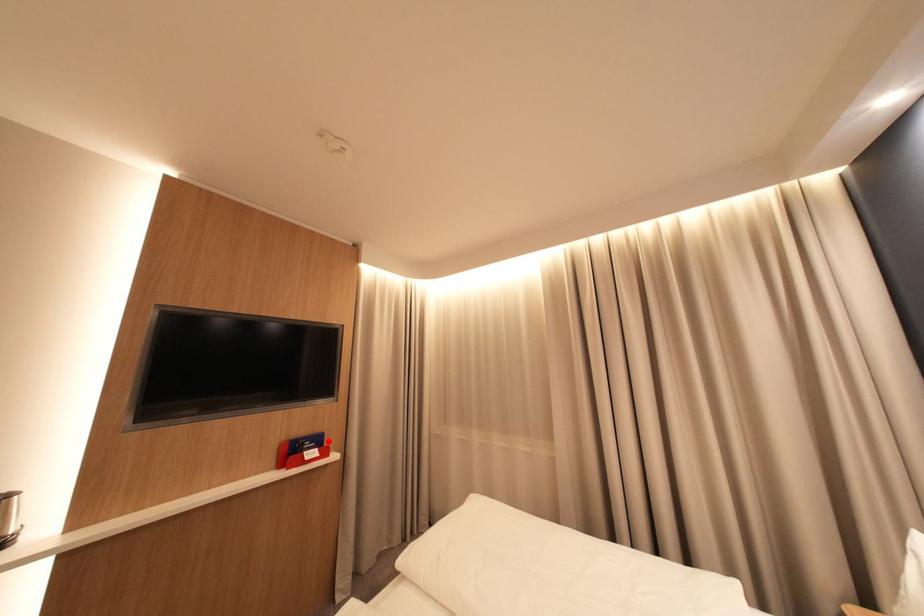
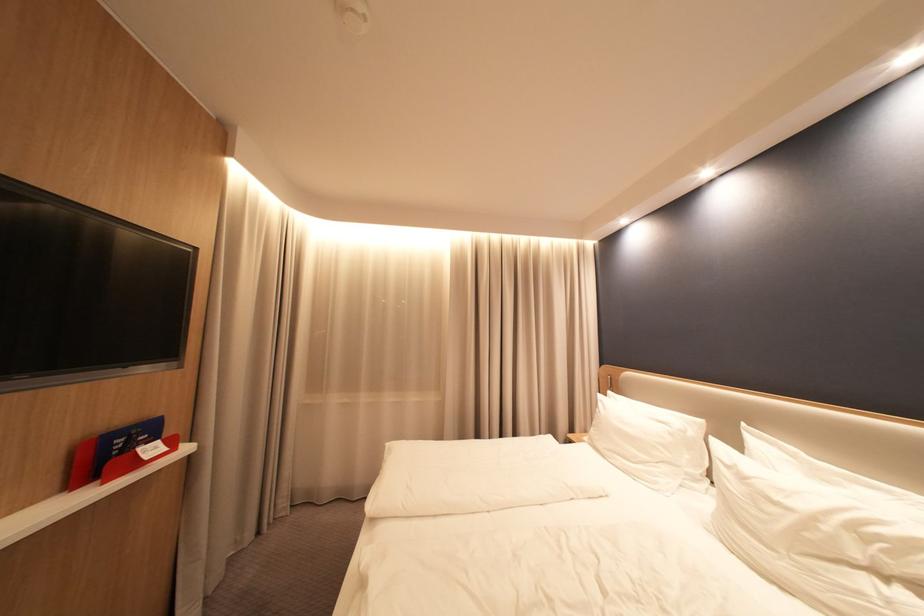
Locate, in the second image, the point that corresponds to the highlighted location in the first image.

(160, 431)